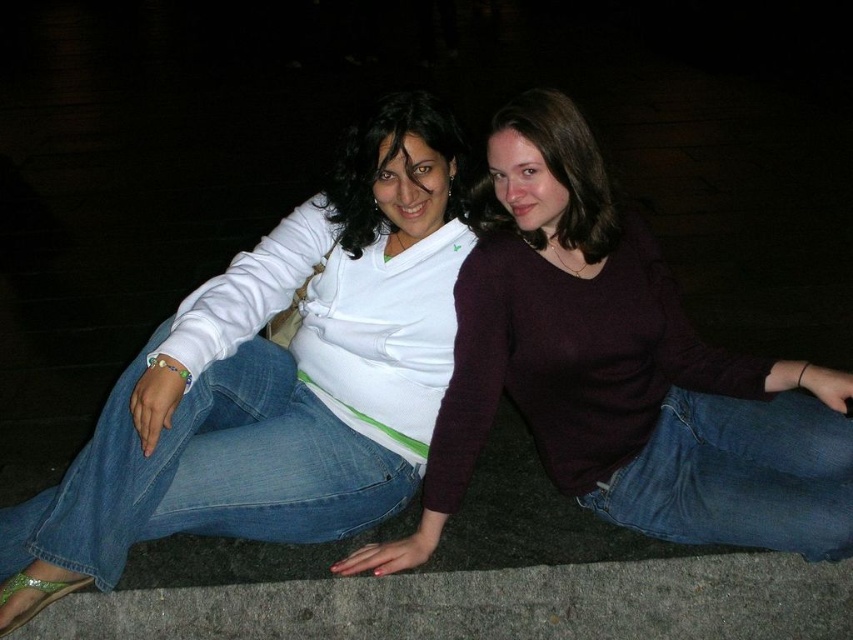
You are a photographer trying to capture a candid shot of the two people in the scene. You notice that the denim jeans at center and jeans at lower right are both in the frame. Which pair of jeans should you focus on if you want to capture the person closer to the camera?

The jeans at lower right are closer to the camera because they are smaller in size compared to the denim jeans at center, which indicates they are farther away.

Looking at this image, you are a photographer trying to capture a candid shot of the two people in the image. You need to ensure that both pairs of jeans are visible in the frame. Given that the denim jeans at center is wider than the jeans at lower right, which pair of jeans should you focus on to ensure they are fully captured in the photo?

The denim jeans at center is wider than the jeans at lower right, so focusing on the denim jeans at center will ensure both pairs are fully visible since it requires more space in the frame.

You are taking a photo of the scene and want to focus on the matte purple sweater at center. Based on its coordinates, where should you aim your camera?

The matte purple sweater at center is located at point 0.584 on the x axis and 0.729 on the y axis.